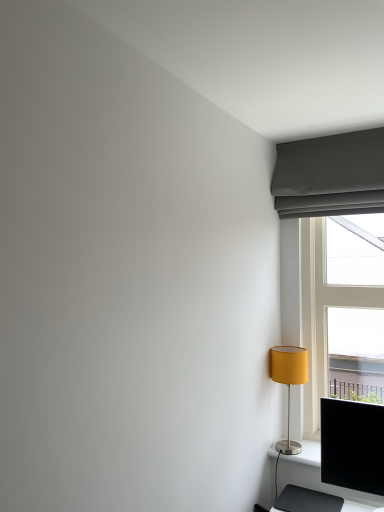
Question: Does white plastic window at right have a lesser width compared to matte yellow fabric lampshade at right?

Choices:
 (A) no
 (B) yes

Answer: (A)

Question: Does white plastic window at right have a greater width compared to matte yellow fabric lampshade at right?

Choices:
 (A) yes
 (B) no

Answer: (A)

Question: Considering the relative positions of white plastic window at right and matte yellow fabric lampshade at right in the image provided, is white plastic window at right to the left of matte yellow fabric lampshade at right from the viewer's perspective?

Choices:
 (A) no
 (B) yes

Answer: (A)

Question: From a real-world perspective, does white plastic window at right sit lower than matte yellow fabric lampshade at right?

Choices:
 (A) yes
 (B) no

Answer: (B)

Question: Would you say matte yellow fabric lampshade at right is part of white plastic window at right's contents?

Choices:
 (A) yes
 (B) no

Answer: (B)

Question: Does white plastic window at right turn towards matte yellow fabric lampshade at right?

Choices:
 (A) yes
 (B) no

Answer: (A)

Question: Is black glossy computer monitor at lower right completely or partially inside matte gray curtain at upper right?

Choices:
 (A) yes
 (B) no

Answer: (B)

Question: Is matte gray curtain at upper right behind black glossy computer monitor at lower right?

Choices:
 (A) yes
 (B) no

Answer: (A)

Question: Can you confirm if matte gray curtain at upper right is positioned to the right of black glossy computer monitor at lower right?

Choices:
 (A) no
 (B) yes

Answer: (B)

Question: From the image's perspective, is matte gray curtain at upper right below black glossy computer monitor at lower right?

Choices:
 (A) yes
 (B) no

Answer: (B)

Question: Is matte gray curtain at upper right wider than black glossy computer monitor at lower right?

Choices:
 (A) yes
 (B) no

Answer: (A)

Question: Are matte gray curtain at upper right and black glossy computer monitor at lower right far apart?

Choices:
 (A) yes
 (B) no

Answer: (B)

Question: Would you consider matte gray curtain at upper right to be distant from matte yellow fabric lampshade at right?

Choices:
 (A) yes
 (B) no

Answer: (B)